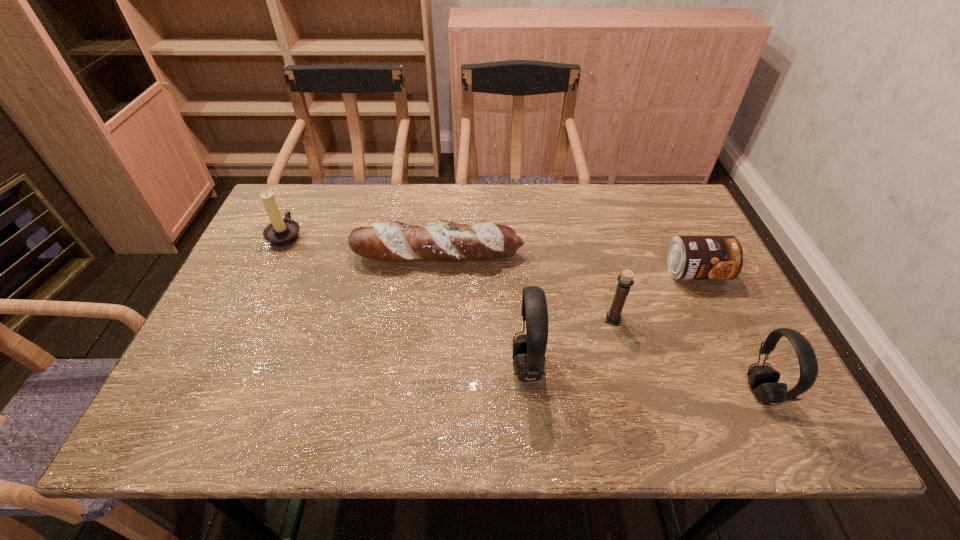
Identify the location of object positioned at the left edge. (281, 232).

You are a GUI agent. You are given a task and a screenshot of the screen. Output one action in this format:
    pyautogui.click(x=<x>, y=<y>)
    Task: Click on the headset that is at the right edge
    The height and width of the screenshot is (540, 960).
    Given the screenshot: What is the action you would take?
    pyautogui.click(x=763, y=380)

Find the location of `can situated at the right edge`. can situated at the right edge is located at coordinates (688, 257).

Where is `object present at the far left corner`? This screenshot has width=960, height=540. object present at the far left corner is located at coordinates (281, 232).

Identify the location of object that is at the near right corner. (763, 380).

Where is `free spot at the far edge of the desktop`? The image size is (960, 540). free spot at the far edge of the desktop is located at coordinates (406, 207).

You are a GUI agent. You are given a task and a screenshot of the screen. Output one action in this format:
    pyautogui.click(x=<x>, y=<y>)
    Task: Click on the free space at the near edge of the desktop
    The image size is (960, 540).
    Given the screenshot: What is the action you would take?
    pyautogui.click(x=596, y=359)

Locate an element on the screen. free spot at the left edge of the desktop is located at coordinates (208, 330).

At what (x,y) coordinates should I click in order to perform the action: click on free space at the right edge of the desktop. Please return your answer as a coordinate pair (x, y). This screenshot has height=540, width=960. Looking at the image, I should click on (685, 235).

At what (x,y) coordinates should I click in order to perform the action: click on free space at the near left corner of the desktop. Please return your answer as a coordinate pair (x, y). Looking at the image, I should click on (250, 392).